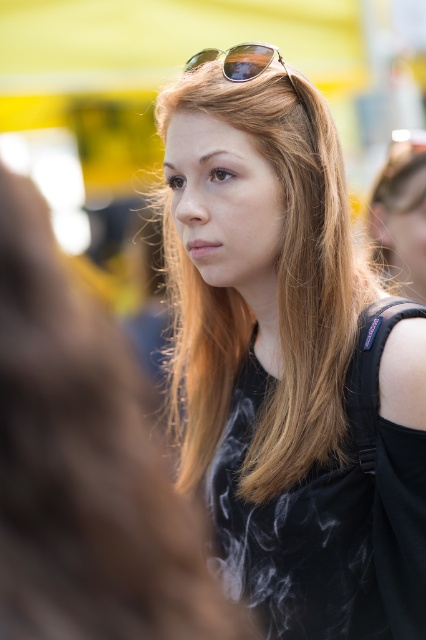
Does matte black shirt at center appear on the right side of smooth brown hair at center?

Correct, you'll find matte black shirt at center to the right of smooth brown hair at center.

From the picture: Is the position of matte black shirt at center more distant than that of smooth brown hair at center?

Yes, matte black shirt at center is further from the viewer.

This screenshot has height=640, width=426. Describe the element at coordinates (290, 364) in the screenshot. I see `matte black shirt at center` at that location.

This screenshot has width=426, height=640. What are the coordinates of `matte black shirt at center` in the screenshot? It's located at (290, 364).

Which is above, smooth brown hair at center or gold reflective sunglasses at upper center?

gold reflective sunglasses at upper center is higher up.

How much distance is there between smooth brown hair at center and gold reflective sunglasses at upper center?

smooth brown hair at center is 30.59 inches from gold reflective sunglasses at upper center.

I want to click on smooth brown hair at center, so click(85, 468).

In order to click on smooth brown hair at center in this screenshot , I will do `click(85, 468)`.

Is matte black shirt at center behind gold reflective sunglasses at upper center?

That is False.

Who is positioned more to the right, matte black shirt at center or gold reflective sunglasses at upper center?

From the viewer's perspective, gold reflective sunglasses at upper center appears more on the right side.

Locate an element on the screen. This screenshot has width=426, height=640. matte black shirt at center is located at coordinates (290, 364).